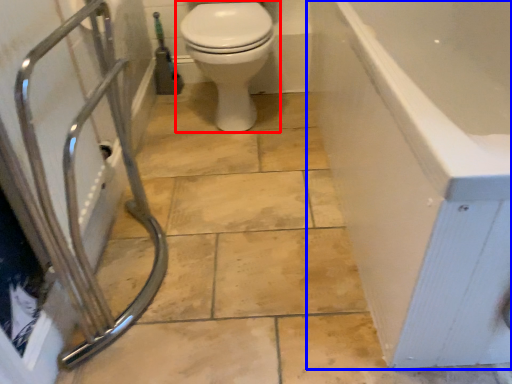
Question: Which point is closer to the camera, toilet (highlighted by a red box) or bathtub (highlighted by a blue box)?

Choices:
 (A) toilet
 (B) bathtub

Answer: (B)